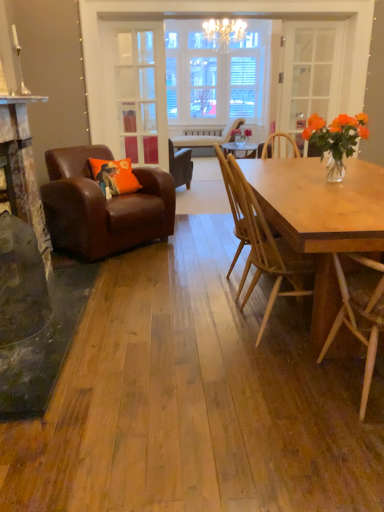
Question: Is brown leather armchair at left, the third chair when ordered from bottom to top, next to leather armchair at center, which is the fourth chair from front to back, and touching it?

Choices:
 (A) no
 (B) yes

Answer: (A)

Question: Is brown leather armchair at left, marked as the second chair in a top-to-bottom arrangement, wider than leather armchair at center, which ranks as the first chair in top-to-bottom order?

Choices:
 (A) no
 (B) yes

Answer: (B)

Question: Is brown leather armchair at left, placed as the 2th chair when sorted from back to front, turned away from leather armchair at center, which is the fourth chair from front to back?

Choices:
 (A) yes
 (B) no

Answer: (B)

Question: Is brown leather armchair at left, the third chair when ordered from bottom to top, to the right of leather armchair at center, which is the 4th chair from bottom to top, from the viewer's perspective?

Choices:
 (A) no
 (B) yes

Answer: (A)

Question: Considering the relative positions of brown leather armchair at left, the third chair when ordered from bottom to top, and leather armchair at center, which is the 4th chair from bottom to top, in the image provided, is brown leather armchair at left, the third chair when ordered from bottom to top, in front of leather armchair at center, which is the 4th chair from bottom to top,?

Choices:
 (A) no
 (B) yes

Answer: (B)

Question: Does brown leather armchair at left, which ranks as the 3th chair in front-to-back order, lie behind leather armchair at center, which is the 4th chair from bottom to top?

Choices:
 (A) no
 (B) yes

Answer: (A)

Question: Does natural wood chair at right, the 3th chair in the back-to-front sequence, contain clear glass door at center, arranged as the first glass door when viewed from the left?

Choices:
 (A) no
 (B) yes

Answer: (A)

Question: From the image's perspective, is natural wood chair at right, the 3th chair in the back-to-front sequence, beneath clear glass door at center, arranged as the first glass door when viewed from the left?

Choices:
 (A) no
 (B) yes

Answer: (B)

Question: From the image's perspective, is natural wood chair at right, positioned as the second chair in front-to-back order, over clear glass door at center, placed as the second glass door when sorted from right to left?

Choices:
 (A) yes
 (B) no

Answer: (B)

Question: Is natural wood chair at right, which ranks as the 3th chair in top-to-bottom order, thinner than clear glass door at center, arranged as the first glass door when viewed from the left?

Choices:
 (A) yes
 (B) no

Answer: (B)

Question: Is natural wood chair at right, the 3th chair in the back-to-front sequence, positioned in front of clear glass door at center, placed as the second glass door when sorted from right to left?

Choices:
 (A) no
 (B) yes

Answer: (B)

Question: Would you consider natural wood chair at right, the 3th chair in the back-to-front sequence, to be distant from clear glass door at center, placed as the second glass door when sorted from right to left?

Choices:
 (A) yes
 (B) no

Answer: (A)

Question: From the image's perspective, is orange fabric pillow at left on top of metallic silver fireplace at left?

Choices:
 (A) no
 (B) yes

Answer: (A)